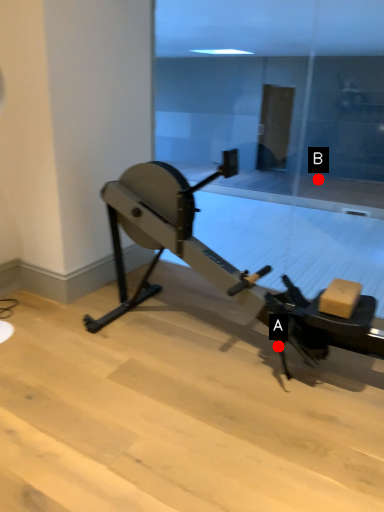
Question: Two points are circled on the image, labeled by A and B beside each circle. Which point is farther from the camera taking this photo?

Choices:
 (A) A is further
 (B) B is further

Answer: (B)